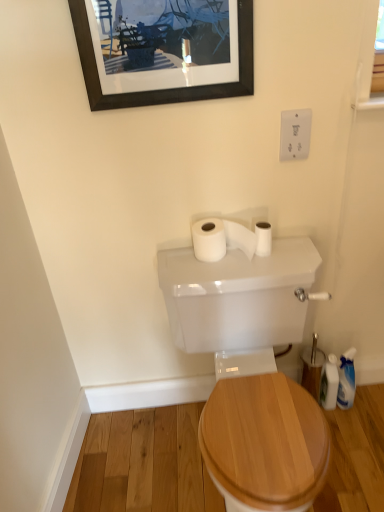
At what (x,y) coordinates should I click in order to perform the action: click on white glossy toilet tank at center. Please return your answer as a coordinate pair (x, y). The width and height of the screenshot is (384, 512). Looking at the image, I should click on (238, 298).

The width and height of the screenshot is (384, 512). What do you see at coordinates (295, 134) in the screenshot?
I see `white plastic outlet at upper right` at bounding box center [295, 134].

Where is `white matte toilet paper at upper center, which appears as the first toilet paper when viewed from the left`? The image size is (384, 512). white matte toilet paper at upper center, which appears as the first toilet paper when viewed from the left is located at coordinates (227, 239).

The width and height of the screenshot is (384, 512). What do you see at coordinates (329, 383) in the screenshot?
I see `white plastic bottle at lower right` at bounding box center [329, 383].

Find the location of a particular element. Image resolution: width=384 pixels, height=512 pixels. white matte toilet paper at upper center, the second toilet paper in the left-to-right sequence is located at coordinates (263, 239).

At what (x,y) coordinates should I click in order to perform the action: click on white glossy toilet tank at center. Please return your answer as a coordinate pair (x, y). Image resolution: width=384 pixels, height=512 pixels. Looking at the image, I should click on (238, 298).

Between white matte toilet paper at upper center, placed as the 1th toilet paper when sorted from right to left, and black matte picture frame at upper center, which one appears on the left side from the viewer's perspective?

From the viewer's perspective, black matte picture frame at upper center appears more on the left side.

Consider the image. Could you tell me if white matte toilet paper at upper center, placed as the 1th toilet paper when sorted from right to left, is turned towards black matte picture frame at upper center?

No, white matte toilet paper at upper center, placed as the 1th toilet paper when sorted from right to left, is not aimed at black matte picture frame at upper center.

Is point (259, 249) closer to viewer compared to point (103, 11)?

That is False.

Which is behind, point (235, 226) or point (231, 2)?

The point (235, 226) is behind.

What's the angular difference between white matte toilet paper at upper center, which appears as the 2th toilet paper when viewed from the right, and black matte picture frame at upper center's facing directions?

The angular difference between white matte toilet paper at upper center, which appears as the 2th toilet paper when viewed from the right, and black matte picture frame at upper center is 0.0322 degrees.

From a real-world perspective, is white matte toilet paper at upper center, which appears as the first toilet paper when viewed from the left, located higher than black matte picture frame at upper center?

No.

Who is taller, white matte toilet paper at upper center, which appears as the 2th toilet paper when viewed from the right, or black matte picture frame at upper center?

With more height is black matte picture frame at upper center.

Are white glossy toilet tank at center and white matte toilet paper at upper center, which appears as the first toilet paper when viewed from the left, far apart?

That's not correct — white glossy toilet tank at center is a little close to white matte toilet paper at upper center, which appears as the first toilet paper when viewed from the left.

Measure the distance from white glossy toilet tank at center to white matte toilet paper at upper center, which appears as the first toilet paper when viewed from the left.

white glossy toilet tank at center and white matte toilet paper at upper center, which appears as the first toilet paper when viewed from the left, are 5.92 inches apart.

Which object is further away from the camera taking this photo, white glossy toilet tank at center or white matte toilet paper at upper center, which appears as the first toilet paper when viewed from the left?

white matte toilet paper at upper center, which appears as the first toilet paper when viewed from the left, is behind.

Is white glossy toilet tank at center positioned with its back to white matte toilet paper at upper center, which appears as the first toilet paper when viewed from the left?

No.

Is white plastic outlet at upper right next to white matte toilet paper at upper center, which appears as the 2th toilet paper when viewed from the right, and touching it?

No, white plastic outlet at upper right is not making contact with white matte toilet paper at upper center, which appears as the 2th toilet paper when viewed from the right.

In terms of width, does white plastic outlet at upper right look wider or thinner when compared to white matte toilet paper at upper center, which appears as the first toilet paper when viewed from the left?

In the image, white plastic outlet at upper right appears to be more narrow than white matte toilet paper at upper center, which appears as the first toilet paper when viewed from the left.

Where is `electric outlet above the white matte toilet paper at upper center, which appears as the 2th toilet paper when viewed from the right (from the image's perspective)`? This screenshot has height=512, width=384. electric outlet above the white matte toilet paper at upper center, which appears as the 2th toilet paper when viewed from the right (from the image's perspective) is located at coordinates (295, 134).

Is white plastic outlet at upper right aimed at white matte toilet paper at upper center, which appears as the first toilet paper when viewed from the left?

No.

From the image's perspective, between white plastic bottle at lower right and black matte picture frame at upper center, who is located below?

white plastic bottle at lower right, from the image's perspective.

How much distance is there between white plastic bottle at lower right and black matte picture frame at upper center?

The distance of white plastic bottle at lower right from black matte picture frame at upper center is 4.26 feet.

Is white plastic bottle at lower right not near black matte picture frame at upper center?

Yes.

Would you say white plastic bottle at lower right is outside black matte picture frame at upper center?

Yes.

Is white glossy toilet tank at center further to camera compared to white plastic outlet at upper right?

No, it is not.

Between white glossy toilet tank at center and white plastic outlet at upper right, which one has more height?

white glossy toilet tank at center.

From the picture: Is white plastic outlet at upper right a part of white glossy toilet tank at center?

No, white plastic outlet at upper right is not inside white glossy toilet tank at center.

Looking at their sizes, would you say black matte picture frame at upper center is wider or thinner than white matte toilet paper at upper center, placed as the 1th toilet paper when sorted from right to left?

black matte picture frame at upper center is thinner than white matte toilet paper at upper center, placed as the 1th toilet paper when sorted from right to left.

Does point (224, 27) lie in front of point (265, 252)?

Yes, point (224, 27) is closer to viewer.

From the image's perspective, who appears lower, black matte picture frame at upper center or white matte toilet paper at upper center, placed as the 1th toilet paper when sorted from right to left?

white matte toilet paper at upper center, placed as the 1th toilet paper when sorted from right to left, is shown below in the image.

Could you measure the distance between black matte picture frame at upper center and white matte toilet paper at upper center, the second toilet paper in the left-to-right sequence?

black matte picture frame at upper center and white matte toilet paper at upper center, the second toilet paper in the left-to-right sequence, are 23.40 inches apart.

I want to click on the 2nd toilet paper below the black matte picture frame at upper center (from the image's perspective), so click(x=263, y=239).

Starting from the black matte picture frame at upper center, which toilet paper is the 1st one to the right? Please provide its 2D coordinates.

[(227, 239)]

Looking at the image, which one is located further to white plastic bottle at lower right, white matte toilet paper at upper center, which appears as the 2th toilet paper when viewed from the right, or white matte toilet paper at upper center, the second toilet paper in the left-to-right sequence?

Based on the image, white matte toilet paper at upper center, which appears as the 2th toilet paper when viewed from the right, appears to be further to white plastic bottle at lower right.

From the image, which object appears to be nearer to white matte toilet paper at upper center, which appears as the first toilet paper when viewed from the left, black matte picture frame at upper center or white glossy toilet tank at center?

Among the two, white glossy toilet tank at center is located nearer to white matte toilet paper at upper center, which appears as the first toilet paper when viewed from the left.

Looking at the image, which one is located further to white plastic outlet at upper right, white plastic bottle at lower right or white matte toilet paper at upper center, which appears as the first toilet paper when viewed from the left?

white plastic bottle at lower right is positioned further to the anchor white plastic outlet at upper right.

Estimate the real-world distances between objects in this image. Which object is closer to black matte picture frame at upper center, white matte toilet paper at upper center, the second toilet paper in the left-to-right sequence, or white plastic bottle at lower right?

Among the two, white matte toilet paper at upper center, the second toilet paper in the left-to-right sequence, is located nearer to black matte picture frame at upper center.

Consider the image. Based on their spatial positions, is black matte picture frame at upper center or white plastic bottle at lower right further from white plastic outlet at upper right?

white plastic bottle at lower right lies further to white plastic outlet at upper right than the other object.

Estimate the real-world distances between objects in this image. Which object is closer to white plastic bottle at lower right, black matte picture frame at upper center or white matte toilet paper at upper center, which appears as the first toilet paper when viewed from the left?

Based on the image, white matte toilet paper at upper center, which appears as the first toilet paper when viewed from the left, appears to be nearer to white plastic bottle at lower right.

From the image, which object appears to be farther from white glossy toilet tank at center, black matte picture frame at upper center or white matte toilet paper at upper center, the second toilet paper in the left-to-right sequence?

Based on the image, black matte picture frame at upper center appears to be further to white glossy toilet tank at center.

Looking at the image, which one is located further to white glossy toilet tank at center, white plastic bottle at lower right or white plastic outlet at upper right?

white plastic bottle at lower right.

Locate an element on the screen. This screenshot has height=512, width=384. toilet paper between white matte toilet paper at upper center, which appears as the first toilet paper when viewed from the left, and white plastic bottle at lower right, in the vertical direction is located at coordinates (x=263, y=239).

Where is `electric outlet that lies between black matte picture frame at upper center and white matte toilet paper at upper center, placed as the 1th toilet paper when sorted from right to left, from top to bottom`? electric outlet that lies between black matte picture frame at upper center and white matte toilet paper at upper center, placed as the 1th toilet paper when sorted from right to left, from top to bottom is located at coordinates (295, 134).

I want to click on toilet paper between white matte toilet paper at upper center, which appears as the 2th toilet paper when viewed from the right, and white glossy toilet tank at center in the up-down direction, so click(263, 239).

Identify the location of sink between white plastic outlet at upper right and white plastic bottle at lower right in the vertical direction. (238, 298).